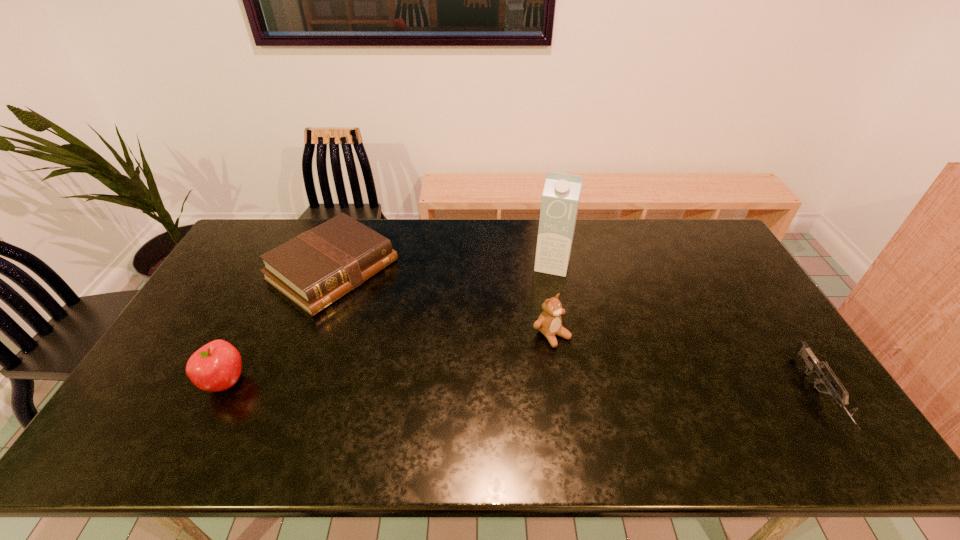
This screenshot has height=540, width=960. Identify the location of apple at the left edge. (216, 366).

Where is `Bible that is positioned at the left edge`? Bible that is positioned at the left edge is located at coordinates (316, 268).

At what (x,y) coordinates should I click in order to perform the action: click on object located at the right edge. Please return your answer as a coordinate pair (x, y). The width and height of the screenshot is (960, 540). Looking at the image, I should click on (812, 363).

Locate an element on the screen. object that is at the far left corner is located at coordinates (316, 268).

I want to click on object located in the near left corner section of the desktop, so click(x=216, y=366).

At what (x,y) coordinates should I click in order to perform the action: click on object positioned at the near right corner. Please return your answer as a coordinate pair (x, y). Looking at the image, I should click on (812, 363).

This screenshot has width=960, height=540. I want to click on vacant region at the far edge of the desktop, so click(650, 220).

The width and height of the screenshot is (960, 540). In the image, there is a desktop. In order to click on vacant space at the right edge in this screenshot , I will do `click(775, 369)`.

You are a GUI agent. You are given a task and a screenshot of the screen. Output one action in this format:
    pyautogui.click(x=<x>, y=<y>)
    Task: Click on the free location at the far left corner of the desktop
    Image resolution: width=960 pixels, height=540 pixels.
    Given the screenshot: What is the action you would take?
    pyautogui.click(x=281, y=222)

In order to click on free space at the near left corner of the desktop in this screenshot , I will do `click(172, 408)`.